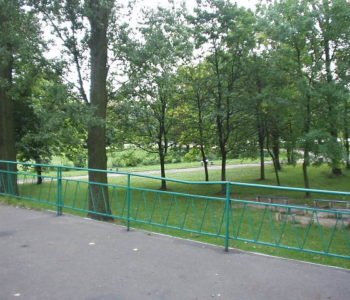
Locate an element on the screen. bench is located at coordinates (276, 197), (335, 200), (294, 214).